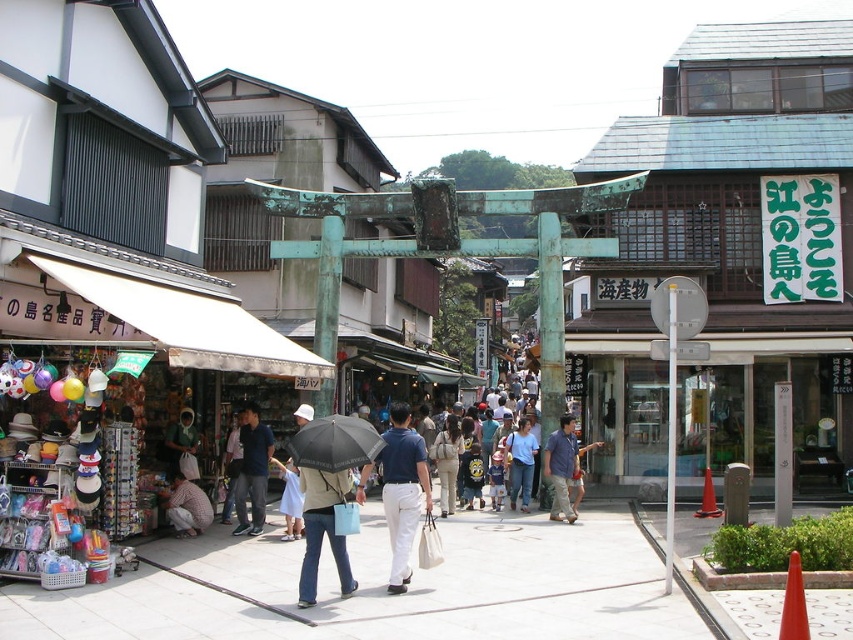
You are a tourist visiting the shrine and see the black matte umbrella at center and the matte black shirt at center. Which object is covering the other?

The black matte umbrella at center is positioned over the matte black shirt at center, so it is covering the shirt.

Looking at this image, you are a tourist standing at the entrance of the shrine and want to locate the black matte umbrella at center. According to the coordinates provided, where should you look relative to the torii gate?

The black matte umbrella at center is located at coordinates point (334, 444), which is to the right and slightly below the torii gate.

You are a photographer trying to capture a candid shot of the two people in the scene. You notice the plaid shirt at center and the matte black shirt at center. Which person should you focus on if you want to capture someone with a wider frame in your photo?

The plaid shirt at center has a larger width than the matte black shirt at center, so focusing on the person wearing the plaid shirt at center would capture a wider frame.